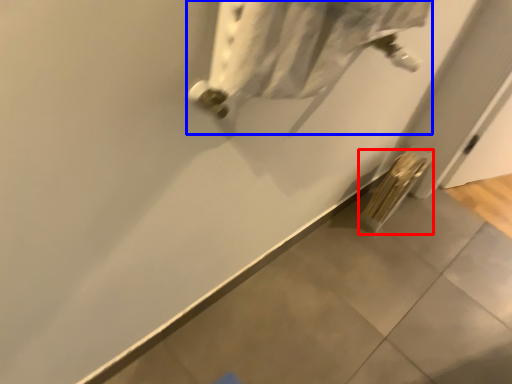
Question: Among these objects, which one is nearest to the camera, radiator (highlighted by a red box) or wide (highlighted by a blue box)?

Choices:
 (A) radiator
 (B) wide

Answer: (B)